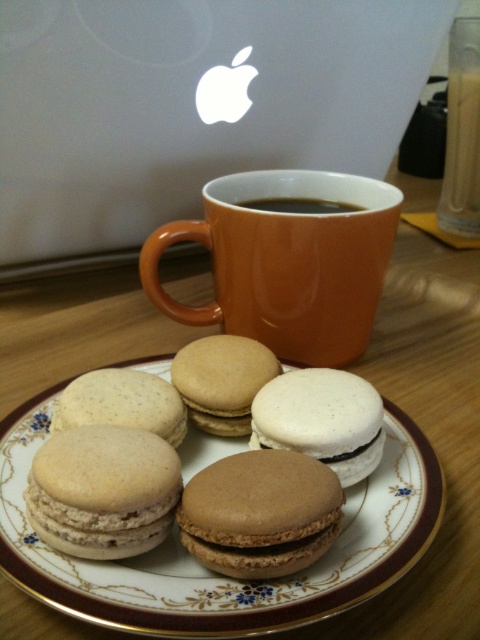
You are arranging items on a table and need to place the orange ceramic mug at upper center and the translucent glass at upper right. According to the scene, where should the orange ceramic mug be positioned relative to the translucent glass?

The orange ceramic mug at upper center should be placed below the translucent glass at upper right.

You are a person with a 70 cm long arm. You want to reach both the orange ceramic mug at upper center and the plate of macarons without moving your body. Is it possible?

The distance between the orange ceramic mug at upper center and the plate of macarons is 78.52 centimeters. Since your arm is only 70 cm long, you cannot reach both items simultaneously without moving your body.

You are a food stylist arranging a photo shoot. You have two items to place in the scene described. The first is the matte brown macarons at center and the second is the matte brown macaron at center. Which of these two items should you place in a position where height is a concern to ensure it doesn t block the view of other elements in the photo?

The matte brown macaron at center should be placed in positions where height is a concern because it is much shorter than the matte brown macarons at center, which is taller and might block the view.